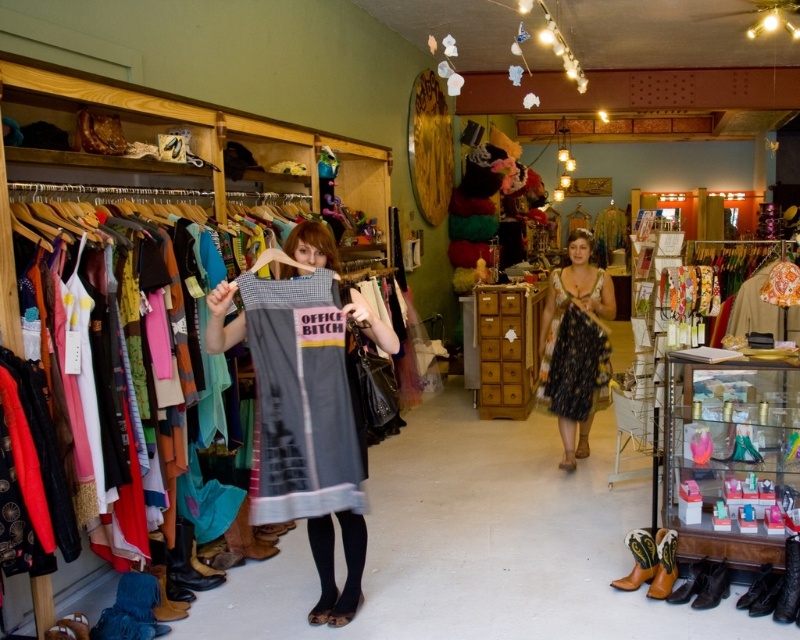
Question: Can you confirm if gray cotton dress at center is positioned above floral-patterned dress at center?

Choices:
 (A) no
 (B) yes

Answer: (A)

Question: Can you confirm if gray cotton dress at center is positioned above floral-patterned dress at center?

Choices:
 (A) yes
 (B) no

Answer: (B)

Question: Which point appears farthest from the camera in this image?

Choices:
 (A) (274, 285)
 (B) (725, 540)
 (C) (304, 236)

Answer: (B)

Question: Is clear glass display case at center bigger than matte black dress at center?

Choices:
 (A) no
 (B) yes

Answer: (A)

Question: Estimate the real-world distances between objects in this image. Which object is closer to the floral-patterned dress at center?

Choices:
 (A) clear glass display case at center
 (B) matte gray dress at center

Answer: (A)

Question: Which point is closer to the camera?

Choices:
 (A) gray cotton dress at center
 (B) matte gray dress at center

Answer: (B)